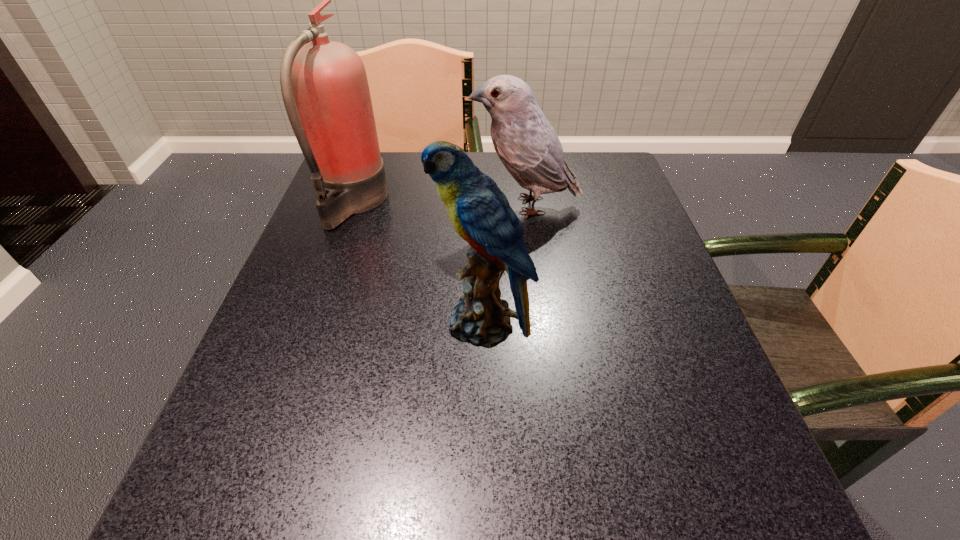
Where is `fire extinguisher`? fire extinguisher is located at coordinates (333, 121).

At what (x,y) coordinates should I click in order to perform the action: click on the tallest object. Please return your answer as a coordinate pair (x, y). Looking at the image, I should click on (333, 121).

Find the location of a particular element. Image resolution: width=960 pixels, height=540 pixels. the nearest object is located at coordinates (480, 212).

The width and height of the screenshot is (960, 540). I want to click on the farther parrot, so click(x=524, y=140).

I want to click on free space located at the nozzle of the tallest object, so click(407, 203).

Where is `vacant space located 0.100m on the face of the nearer parrot`? The image size is (960, 540). vacant space located 0.100m on the face of the nearer parrot is located at coordinates (380, 323).

Locate an element on the screen. This screenshot has height=540, width=960. blank space located 0.050m on the face of the nearer parrot is located at coordinates (408, 323).

Where is `free space located 0.190m on the face of the nearer parrot`? This screenshot has height=540, width=960. free space located 0.190m on the face of the nearer parrot is located at coordinates (329, 323).

I want to click on free region located on the front-facing side of the farther parrot, so pyautogui.click(x=444, y=206).

You are a GUI agent. You are given a task and a screenshot of the screen. Output one action in this format:
    pyautogui.click(x=<x>, y=<y>)
    Task: Click on the vacant point located on the front-facing side of the farther parrot
    This screenshot has height=540, width=960.
    Given the screenshot: What is the action you would take?
    pyautogui.click(x=322, y=206)